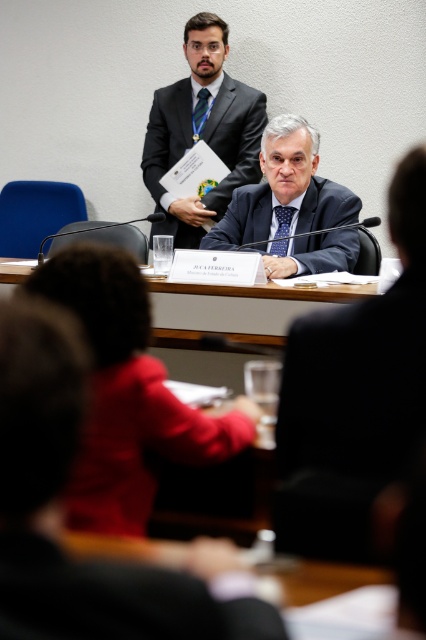
Question: Based on their relative distances, which object is nearer to the matte black suit at upper center?

Choices:
 (A) dark blue fabric business suit at center
 (B) white plastic table at center
 (C) matte black suit at center
 (D) matte black jacket at center

Answer: (C)

Question: Can you confirm if black fabric business suit at center is positioned to the left of matte black suit at upper center?

Choices:
 (A) yes
 (B) no

Answer: (B)

Question: Which of the following is the farthest from the observer?

Choices:
 (A) matte black suit at center
 (B) black fabric business suit at center
 (C) matte black jacket at center

Answer: (A)

Question: Is matte black jacket at center to the right of black fabric business suit at center from the viewer's perspective?

Choices:
 (A) no
 (B) yes

Answer: (A)

Question: Which of the following is the closest to the observer?

Choices:
 (A) black fabric business suit at center
 (B) white plastic table at center
 (C) matte black suit at center
 (D) matte black suit at upper center

Answer: (A)

Question: Observing the image, what is the correct spatial positioning of matte black suit at upper center in reference to white plastic table at center?

Choices:
 (A) below
 (B) above

Answer: (B)